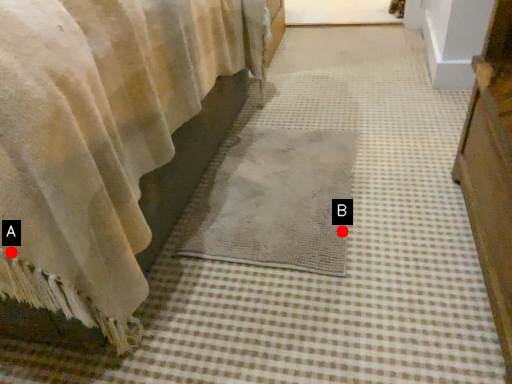
Question: Two points are circled on the image, labeled by A and B beside each circle. Which of the following is the closest to the observer?

Choices:
 (A) A is closer
 (B) B is closer

Answer: (A)